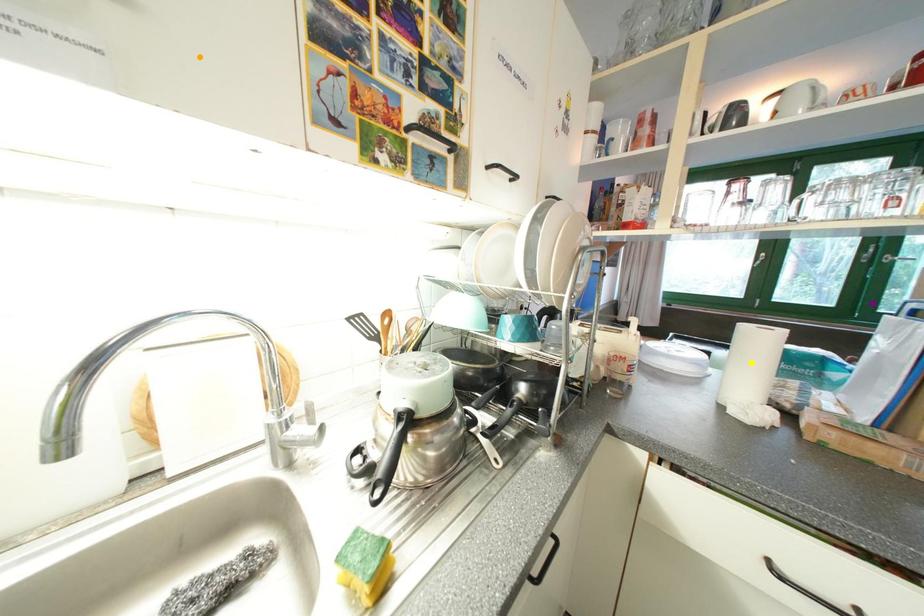
Order these from nearest to farthest:
1. orange point
2. yellow point
3. purple point

orange point
purple point
yellow point